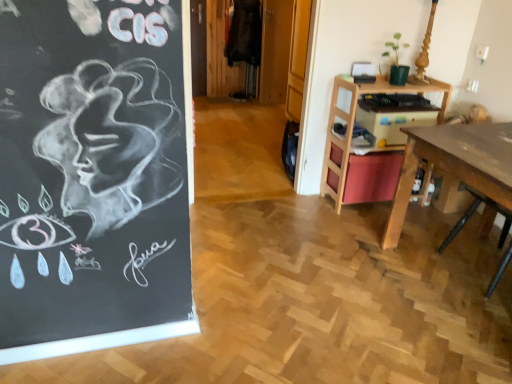
Question: From the image's perspective, is wooden desk at right located above or below wooden desk at right?

Choices:
 (A) above
 (B) below

Answer: (A)

Question: Looking at the image, does wooden desk at right seem bigger or smaller compared to wooden desk at right?

Choices:
 (A) small
 (B) big

Answer: (A)

Question: Would you say wooden desk at right is to the left or to the right of wooden desk at right in the picture?

Choices:
 (A) left
 (B) right

Answer: (A)

Question: From a real-world perspective, relative to wooden desk at right, is wooden desk at right vertically above or below?

Choices:
 (A) above
 (B) below

Answer: (B)

Question: From the image's perspective, is wooden desk at right positioned above or below wooden desk at right?

Choices:
 (A) below
 (B) above

Answer: (A)

Question: Is wooden desk at right to the left or to the right of wooden desk at right in the image?

Choices:
 (A) left
 (B) right

Answer: (B)

Question: Do you think wooden desk at right is within wooden desk at right, or outside of it?

Choices:
 (A) inside
 (B) outside

Answer: (B)